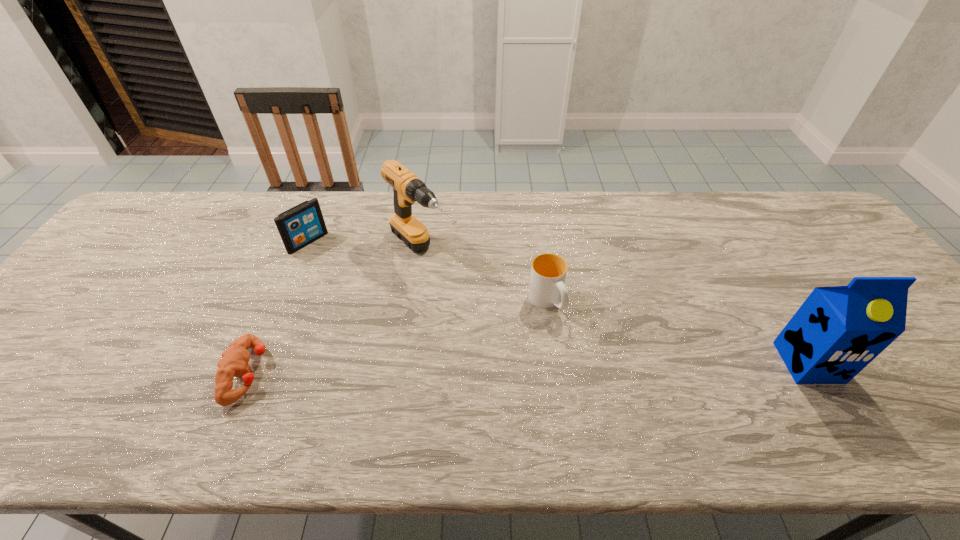
Where is `free space at the far edge`? The image size is (960, 540). free space at the far edge is located at coordinates (348, 204).

Image resolution: width=960 pixels, height=540 pixels. Identify the location of vacant space at the left edge of the desktop. (32, 359).

Image resolution: width=960 pixels, height=540 pixels. In order to click on vacant region at the near left corner in this screenshot , I will do `click(55, 395)`.

In the image, there is a desktop. Where is `vacant area at the far right corner`? vacant area at the far right corner is located at coordinates (758, 190).

At what (x,y) coordinates should I click in order to perform the action: click on vacant area that lies between the rightmost object and the cup. Please return your answer as a coordinate pair (x, y). This screenshot has height=540, width=960. Looking at the image, I should click on (677, 332).

At what (x,y) coordinates should I click in order to perform the action: click on empty space that is in between the fourth object from left to right and the iPod. Please return your answer as a coordinate pair (x, y). This screenshot has height=540, width=960. Looking at the image, I should click on (427, 272).

Identify the location of free point between the rightmost object and the puncher. (528, 368).

In order to click on free space between the carton and the shortest object in this screenshot , I will do `click(528, 368)`.

Identify the location of free space between the puncher and the third object from right to left. This screenshot has width=960, height=540. (336, 313).

Find the location of a particular element. free spot between the drill and the shortest object is located at coordinates (336, 313).